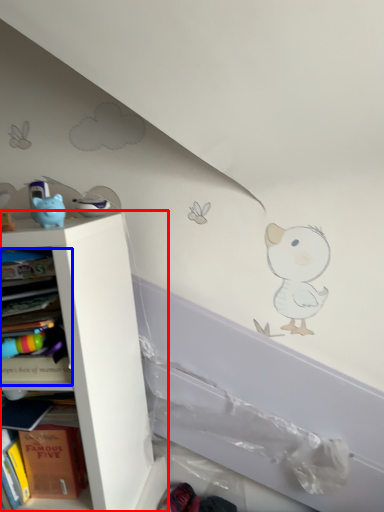
Question: Among these objects, which one is farthest to the camera, shelf (highlighted by a red box) or book (highlighted by a blue box)?

Choices:
 (A) shelf
 (B) book

Answer: (A)